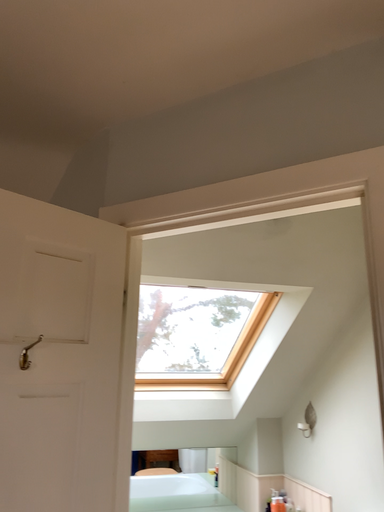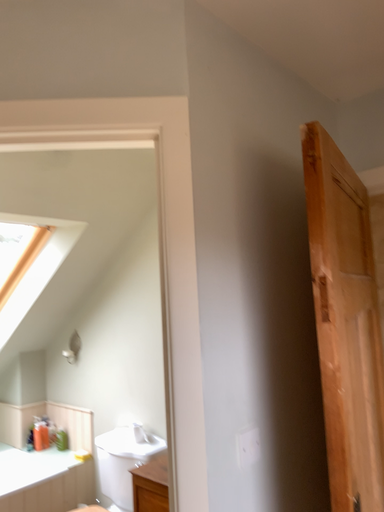
Question: How did the camera likely rotate when shooting the video?

Choices:
 (A) rotated downward
 (B) rotated upward

Answer: (A)